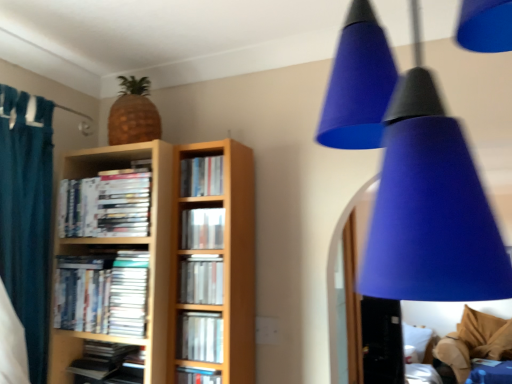
Question: In terms of width, does white paper at center look wider or thinner when compared to hardcover books at center, the first book when ordered from top to bottom?

Choices:
 (A) wide
 (B) thin

Answer: (A)

Question: Is white paper at center to the left or to the right of hardcover books at center, which is the 8th book in bottom-to-top order, in the image?

Choices:
 (A) right
 (B) left

Answer: (B)

Question: Estimate the real-world distances between objects in this image. Which object is closer to the hardcover book at center, positioned as the first book in bottom-to-top order?

Choices:
 (A) matte black book at lower left, the second book in the bottom-to-top sequence
 (B) matte plastic books at left, which appears as the second book when viewed from the top
 (C) matte silver book at center, which is the sixth book in top-to-bottom order
 (D) wooden bookcase at center
 (E) matte plastic books at center left, the fourth book in the bottom-to-top sequence

Answer: (C)

Question: Which is nearer to the matte plastic books at center left, which appears as the fifth book when viewed from the top?

Choices:
 (A) hardcover books at center, the first book when ordered from top to bottom
 (B) white soft pillow at lower right
 (C) matte silver book at center, which is the sixth book in top-to-bottom order
 (D) matte black book at lower left, the second book in the bottom-to-top sequence
 (E) hardcover book at center, positioned as the first book in bottom-to-top order

Answer: (D)